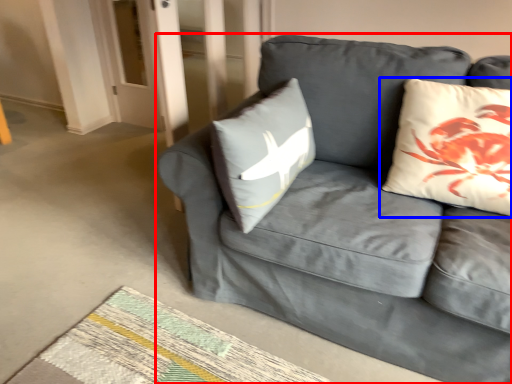
Question: Which of the following is the closest to the observer, studio couch (highlighted by a red box) or pillow (highlighted by a blue box)?

Choices:
 (A) studio couch
 (B) pillow

Answer: (A)